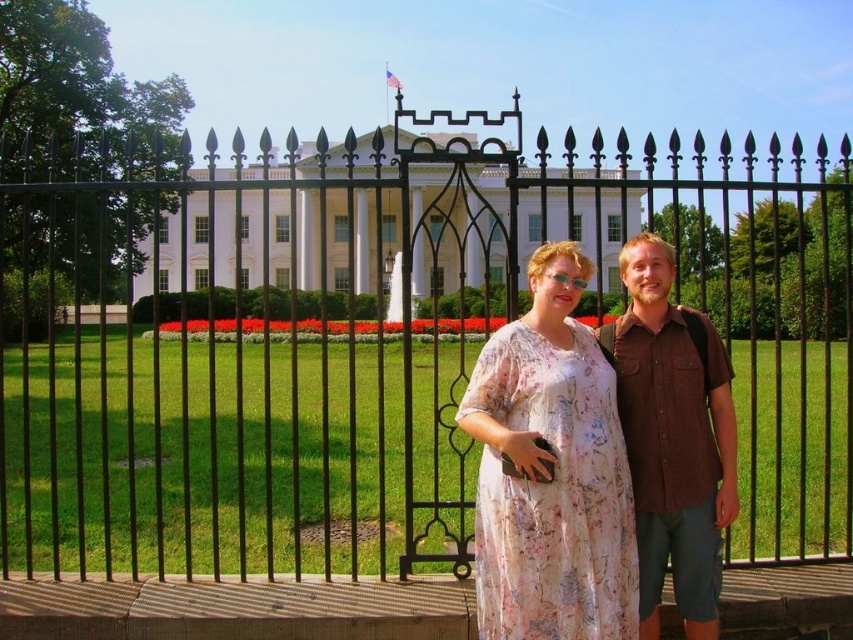
Is black wrought iron gate at center wider than brown cotton shirt at center?

Correct, the width of black wrought iron gate at center exceeds that of brown cotton shirt at center.

Does point (381, 154) lie in front of point (640, 244)?

No, (381, 154) is further to viewer.

This screenshot has height=640, width=853. What are the coordinates of `black wrought iron gate at center` in the screenshot? It's located at (379, 340).

Who is shorter, black wrought iron gate at center or floral chiffon dress at center?

floral chiffon dress at center is shorter.

At what (x,y) coordinates should I click in order to perform the action: click on black wrought iron gate at center. Please return your answer as a coordinate pair (x, y). The height and width of the screenshot is (640, 853). Looking at the image, I should click on (379, 340).

Who is more forward, (277, 442) or (524, 570)?

Positioned in front is point (524, 570).

Find the location of `black wrought iron gate at center`. black wrought iron gate at center is located at coordinates (379, 340).

Is point (525, 600) farther from camera compared to point (672, 529)?

No.

Does floral chiffon dress at center have a lesser width compared to brown cotton shirt at center?

Yes.

This screenshot has height=640, width=853. Describe the element at coordinates (550, 492) in the screenshot. I see `floral chiffon dress at center` at that location.

Where is `floral chiffon dress at center`? Image resolution: width=853 pixels, height=640 pixels. floral chiffon dress at center is located at coordinates (550, 492).